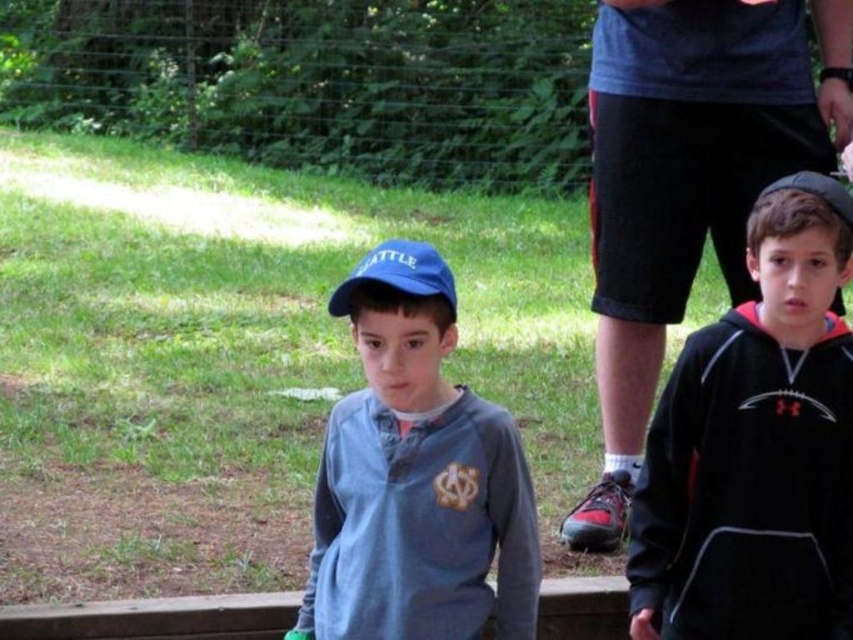
You are a photographer trying to capture a clear shot of the black fleece sweatshirt at right. Based on its coordinates, where should you position your camera relative to the boys?

The black fleece sweatshirt at right is located at coordinates point (x=756, y=445), so you should position your camera to the right side of the boys to capture it clearly.

You are a photographer trying to capture a photo of the black fleece sweatshirt at right and the matte blue cap at center. Which object should you focus on first if you want to ensure both are in sharp focus, considering their heights?

The black fleece sweatshirt at right is taller than the matte blue cap at center, so focusing on the black fleece sweatshirt at right first will help ensure both are in sharp focus since it is the taller object.